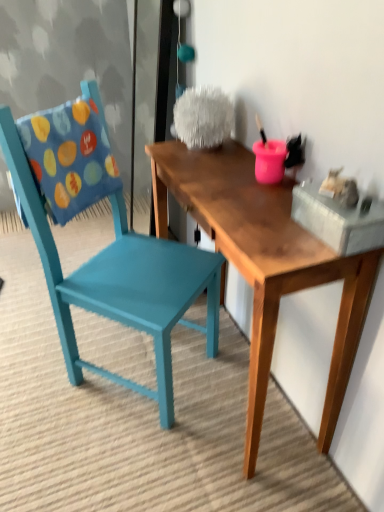
The height and width of the screenshot is (512, 384). I want to click on free space in front of teal painted wood chair at left, so click(x=124, y=458).